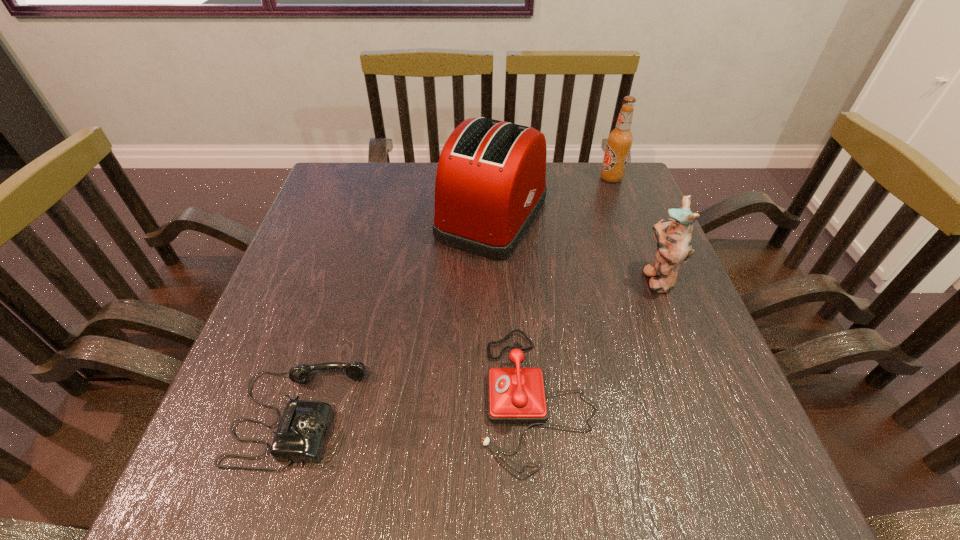
This screenshot has height=540, width=960. What are the coordinates of `figurine at the right edge` in the screenshot? It's located at (673, 238).

Find the location of `object that is at the near left corner`. object that is at the near left corner is located at coordinates (301, 435).

The width and height of the screenshot is (960, 540). What are the coordinates of `object situated at the far right corner` in the screenshot? It's located at (619, 141).

I want to click on free space at the far edge of the desktop, so click(x=548, y=170).

Where is `free point at the near edge`? free point at the near edge is located at coordinates (337, 499).

In the image, there is a desktop. Where is `vacant space at the left edge`? vacant space at the left edge is located at coordinates (345, 254).

Image resolution: width=960 pixels, height=540 pixels. In the image, there is a desktop. Find the location of `blank space at the right edge`. blank space at the right edge is located at coordinates (659, 393).

You are a GUI agent. You are given a task and a screenshot of the screen. Output one action in this format:
    pyautogui.click(x=<x>, y=<y>)
    Task: Click on the vacant space at the near left corner
    The height and width of the screenshot is (540, 960).
    Given the screenshot: What is the action you would take?
    [230, 492]

This screenshot has width=960, height=540. In order to click on free space between the toaster and the right telephone in this screenshot , I will do `click(516, 306)`.

I want to click on free space between the beer bottle and the toaster, so click(552, 197).